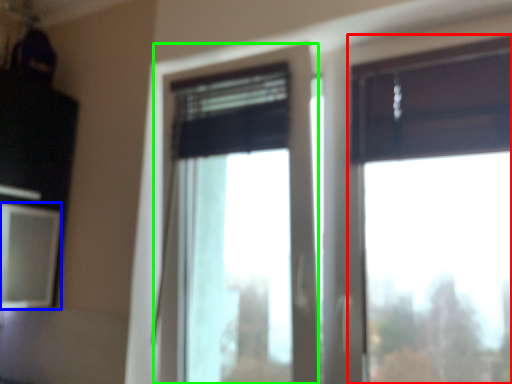
Question: Which object is the farthest from window (highlighted by a red box)? Choose among these: window screen (highlighted by a blue box) or window (highlighted by a green box).

Choices:
 (A) window screen
 (B) window

Answer: (A)